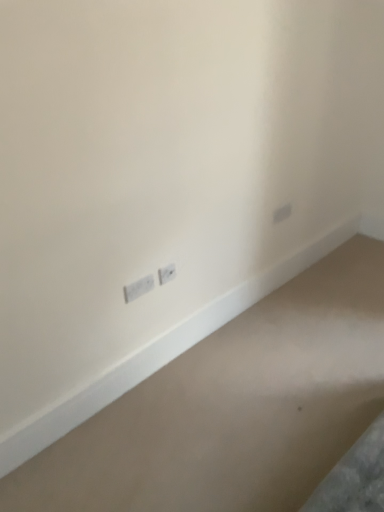
Question: Would you say white plastic power plugs and sockets at lower left, the 1th power plugs and sockets positioned from the left, is inside or outside white plastic power plugs and sockets at center, which is the first power plugs and sockets from right to left?

Choices:
 (A) inside
 (B) outside

Answer: (B)

Question: Considering their positions, is white plastic power plugs and sockets at lower left, the 1th power plugs and sockets positioned from the left, located in front of or behind white plastic power plugs and sockets at center, which is the first power plugs and sockets from right to left?

Choices:
 (A) front
 (B) behind

Answer: (A)

Question: Which of these objects is positioned farthest from the white plastic power plugs and sockets at lower left, the 1th power plugs and sockets positioned from the left?

Choices:
 (A) smooth beige carpet at bottom
 (B) white plastic power plugs and sockets at center, which is the first power plugs and sockets from right to left

Answer: (A)

Question: Which of these objects is positioned closest to the white plastic power plugs and sockets at center, the 2th power plugs and sockets in the left-to-right sequence?

Choices:
 (A) white plastic power plugs and sockets at lower left, the 1th power plugs and sockets positioned from the left
 (B) smooth beige carpet at bottom

Answer: (A)